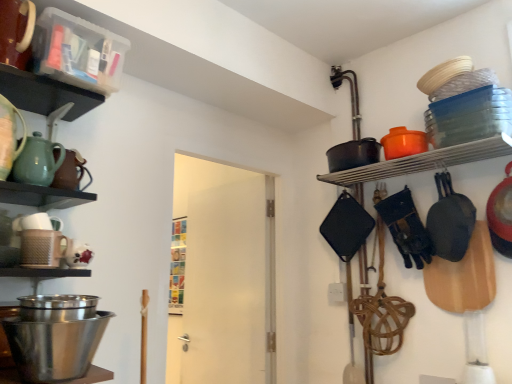
Question: Can you confirm if clear plastic container at upper left, which is the 1th shelf in left-to-right order, is positioned to the left of matte brown teapot at left, which is the 2th tea pot from front to back?

Choices:
 (A) yes
 (B) no

Answer: (B)

Question: Is clear plastic container at upper left, arranged as the 2th shelf when viewed from the back, oriented away from matte brown teapot at left, the 1th tea pot from the back?

Choices:
 (A) yes
 (B) no

Answer: (B)

Question: Is clear plastic container at upper left, arranged as the 2th shelf when viewed from the back, not close to matte brown teapot at left, the 1th tea pot from the back?

Choices:
 (A) no
 (B) yes

Answer: (A)

Question: Is clear plastic container at upper left, which appears as the second shelf when ordered from the bottom, beside matte brown teapot at left, which is the 2th tea pot from front to back?

Choices:
 (A) yes
 (B) no

Answer: (B)

Question: Does clear plastic container at upper left, the 1th shelf positioned from the front, come in front of matte brown teapot at left, the 1th tea pot from the back?

Choices:
 (A) yes
 (B) no

Answer: (A)

Question: From a real-world perspective, is black matte frying pan at right physically located above or below matte black pot at upper right, placed as the first shelf when sorted from back to front?

Choices:
 (A) above
 (B) below

Answer: (B)

Question: Considering the positions of black matte frying pan at right and matte black pot at upper right, placed as the first shelf when sorted from back to front, in the image, is black matte frying pan at right wider or thinner than matte black pot at upper right, placed as the first shelf when sorted from back to front,?

Choices:
 (A) thin
 (B) wide

Answer: (A)

Question: Is black matte frying pan at right in front of or behind matte black pot at upper right, placed as the first shelf when sorted from back to front, in the image?

Choices:
 (A) front
 (B) behind

Answer: (B)

Question: Based on their sizes in the image, would you say black matte frying pan at right is bigger or smaller than matte black pot at upper right, placed as the first shelf when sorted from back to front?

Choices:
 (A) small
 (B) big

Answer: (B)

Question: Is point (81, 175) closer or farther from the camera than point (79, 322)?

Choices:
 (A) farther
 (B) closer

Answer: (A)

Question: In the image, is matte brown teapot at left, the 1th tea pot from the back, on the left side or the right side of polished stainless steel mixing bowl at lower left?

Choices:
 (A) right
 (B) left

Answer: (B)

Question: From the image's perspective, is matte brown teapot at left, which is the 2th tea pot from front to back, located above or below polished stainless steel mixing bowl at lower left?

Choices:
 (A) above
 (B) below

Answer: (A)

Question: From a real-world perspective, is matte brown teapot at left, the 1th tea pot from the back, positioned above or below polished stainless steel mixing bowl at lower left?

Choices:
 (A) above
 (B) below

Answer: (A)

Question: Is point (66, 81) closer or farther from the camera than point (494, 147)?

Choices:
 (A) closer
 (B) farther

Answer: (A)

Question: In terms of width, does clear plastic container at upper left, which appears as the second shelf when ordered from the bottom, look wider or thinner when compared to matte black pot at upper right, which is the 2th shelf from left to right?

Choices:
 (A) wide
 (B) thin

Answer: (A)